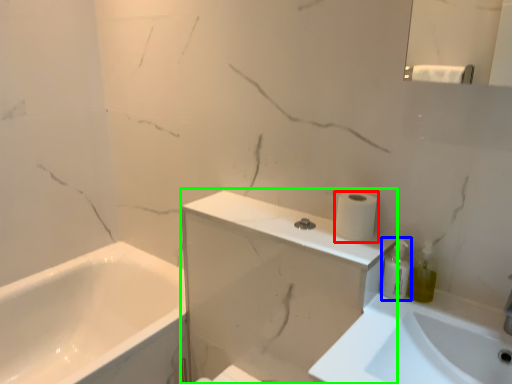
Question: Estimate the real-world distances between objects in this image. Which object is closer to toilet paper (highlighted by a red box), toiletry (highlighted by a blue box) or medicine cabinet (highlighted by a green box)?

Choices:
 (A) toiletry
 (B) medicine cabinet

Answer: (A)